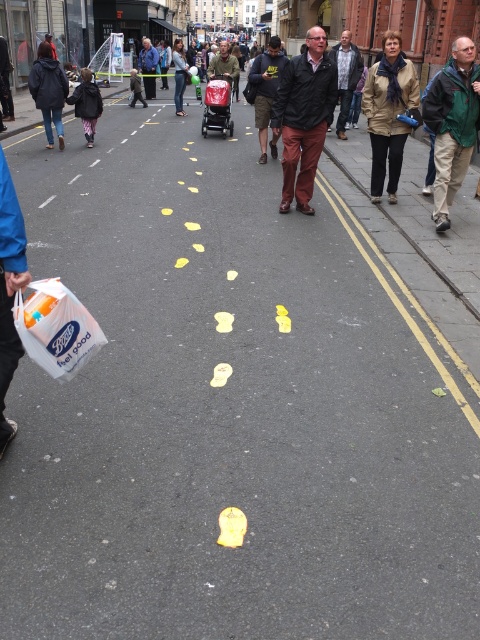
You are standing on the street and see a green jacket at right and a light brown leather jacket at center. Which jacket is nearer to you?

The green jacket at right is closer to the viewer than the light brown leather jacket at center.

You are a photographer standing on the sidewalk and want to capture both the green jacket at right and the light brown leather jacket at center in a single photo. Which jacket should you focus on first to ensure both are in frame?

The green jacket at right is located below the light brown leather jacket at center, so you should focus on the light brown leather jacket at center first to ensure both are in frame.

You are a delivery person who needs to hand a package to the person wearing the dark brown leather jacket at center and the matte green jacket at center. The delivery cart you are using has a 15 feet long ramp. Can you use the ramp to reach both recipients at the same time?

The dark brown leather jacket at center and the matte green jacket at center are 27.00 feet apart from each other. Since the ramp is only 15 feet long, it cannot span the distance between them. Therefore, you cannot use the ramp to reach both recipients simultaneously.